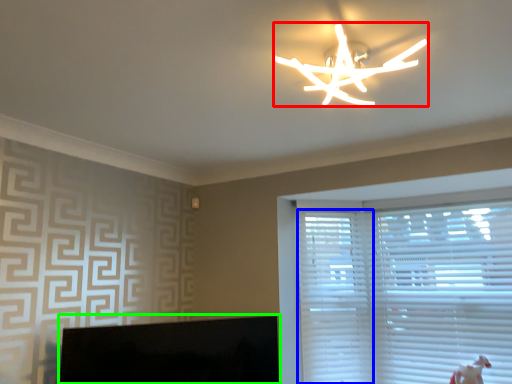
Question: Which object is the closest to the lamp (highlighted by a red box)? Choose among these: blind (highlighted by a blue box) or computer monitor (highlighted by a green box).

Choices:
 (A) blind
 (B) computer monitor

Answer: (B)